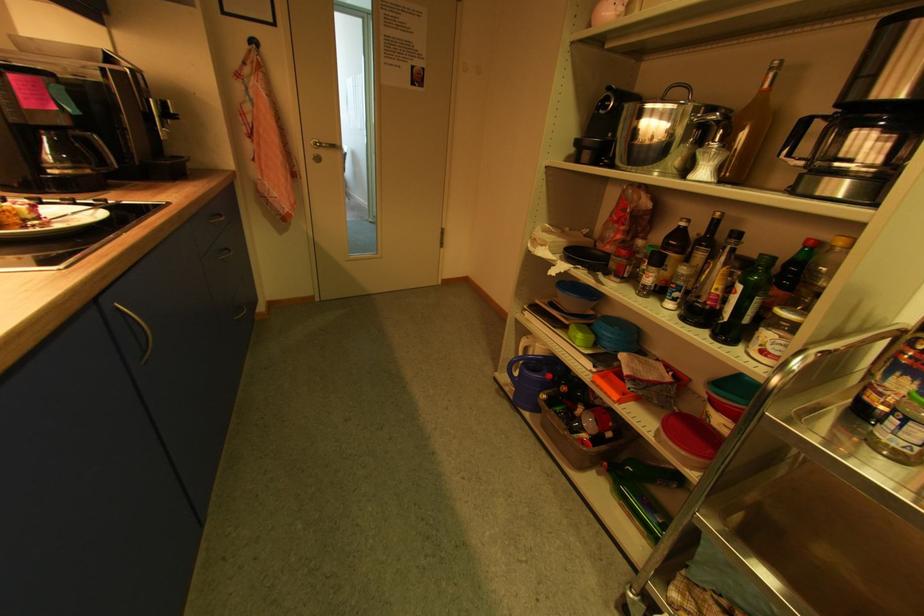
The location [688,439] corresponds to which object?

It refers to a red lidded container.